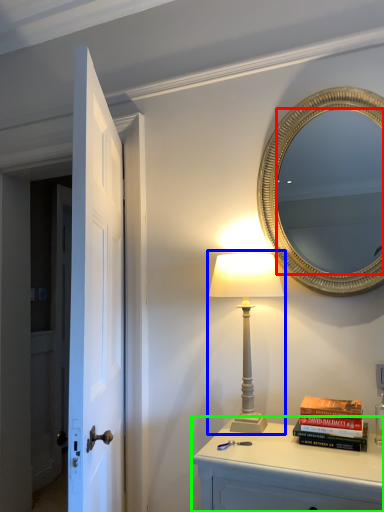
Question: Which object is the closest to the mirror (highlighted by a red box)? Choose among these: table lamp (highlighted by a blue box) or nightstand (highlighted by a green box).

Choices:
 (A) table lamp
 (B) nightstand

Answer: (A)